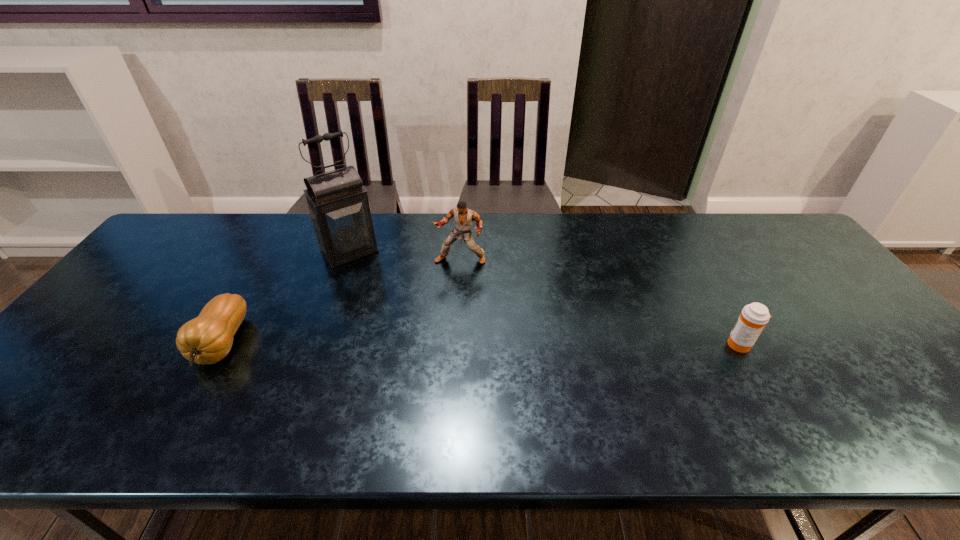
Image resolution: width=960 pixels, height=540 pixels. Find the location of `the leftmost object`. the leftmost object is located at coordinates (208, 338).

The image size is (960, 540). Find the location of `the rightmost object`. the rightmost object is located at coordinates (754, 316).

Where is `puncher`? The width and height of the screenshot is (960, 540). puncher is located at coordinates (463, 217).

Where is `the third shortest object`? The height and width of the screenshot is (540, 960). the third shortest object is located at coordinates (463, 217).

This screenshot has height=540, width=960. Find the location of `lantern`. lantern is located at coordinates tap(338, 206).

Locate an element on the screen. the tallest object is located at coordinates (338, 206).

Locate an element on the screen. The width and height of the screenshot is (960, 540). free spot located 0.050m on the stem side of the leftmost object is located at coordinates (189, 401).

At what (x,y) coordinates should I click in order to perform the action: click on vacant position located 0.310m on the right of the rightmost object. Please return your answer as a coordinate pair (x, y). Looking at the image, I should click on (878, 345).

This screenshot has width=960, height=540. In order to click on vacant space located 0.360m on the front-facing side of the third shortest object in this screenshot , I will do `click(410, 360)`.

Identify the location of free space located 0.340m on the front-facing side of the third shortest object. The height and width of the screenshot is (540, 960). (413, 354).